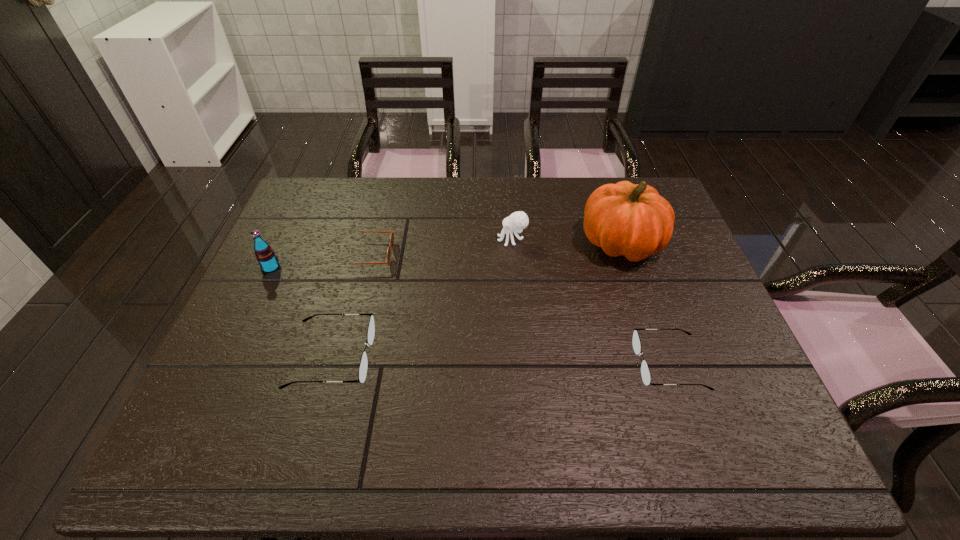
Image resolution: width=960 pixels, height=540 pixels. What are the coordinates of `object that is the third nearest to the right spectacles` in the screenshot? It's located at (362, 373).

Locate an element on the screen. This screenshot has height=540, width=960. the fifth closest object to the pumpkin is located at coordinates (265, 255).

Locate an element on the screen. vacant area in the image that satisfies the following two spatial constraints: 1. on the front-facing side of the sunglasses; 2. on the front side of the soda is located at coordinates (366, 268).

Image resolution: width=960 pixels, height=540 pixels. Identify the location of blank area in the image that satisfies the following two spatial constraints: 1. on the front side of the pumpkin; 2. on the lenses of the taller spectacles. (659, 357).